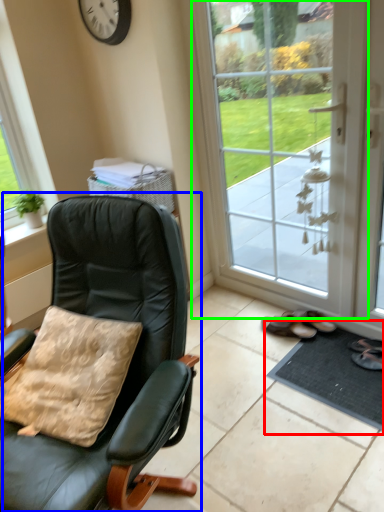
Question: Which object is the closest to the doormat (highlighted by a red box)? Choose among these: chair (highlighted by a blue box) or door (highlighted by a green box).

Choices:
 (A) chair
 (B) door

Answer: (B)